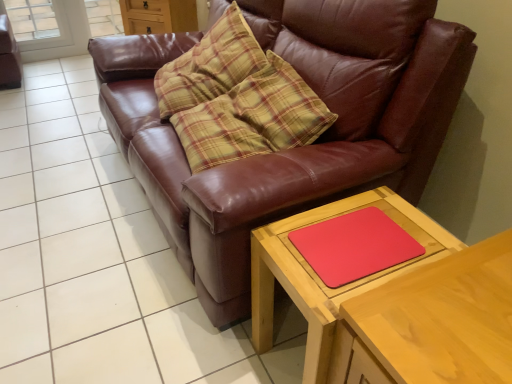
Where is `free space underneath rubberized red mouse pad at lower right (from a real-world perspective)`? free space underneath rubberized red mouse pad at lower right (from a real-world perspective) is located at coordinates (358, 244).